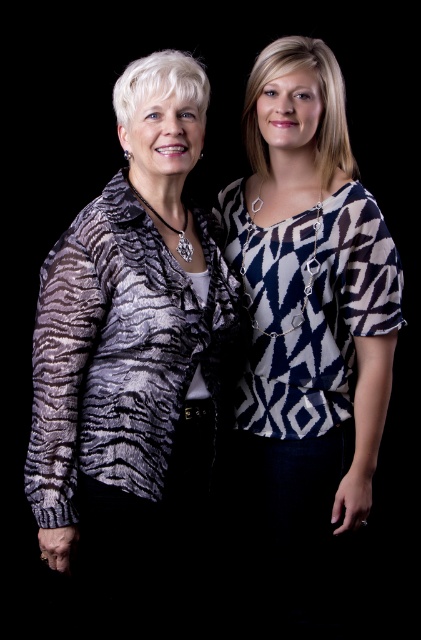
Question: Which object appears closest to the camera in this image?

Choices:
 (A) zebra print jacket at left
 (B) textured black and white sweater at left

Answer: (A)

Question: Does zebra print jacket at left appear on the right side of textured black and white sweater at left?

Choices:
 (A) no
 (B) yes

Answer: (A)

Question: Does zebra print jacket at left have a lesser width compared to textured black and white sweater at left?

Choices:
 (A) no
 (B) yes

Answer: (A)

Question: In this image, where is zebra print jacket at left located relative to textured black and white sweater at left?

Choices:
 (A) left
 (B) right

Answer: (A)